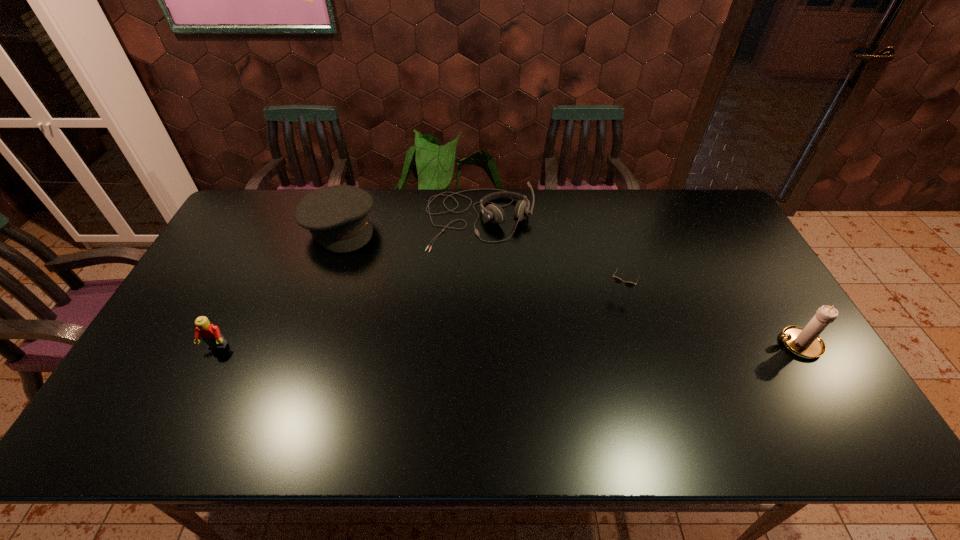
This screenshot has height=540, width=960. I want to click on unoccupied position between the rightmost object and the leftmost object, so click(508, 346).

Where is `vacant space in between the leftmost object and the fourth object from left to right`? This screenshot has height=540, width=960. vacant space in between the leftmost object and the fourth object from left to right is located at coordinates point(418,319).

Where is `vacant space that's between the headset and the leftmost object`? vacant space that's between the headset and the leftmost object is located at coordinates (348, 283).

I want to click on free space that is in between the tallest object and the fourth object from right to left, so click(569, 286).

Where is `vacant point located between the beret and the candle holder`? vacant point located between the beret and the candle holder is located at coordinates (569, 286).

Identify the location of vacant region between the Lego and the headset. The height and width of the screenshot is (540, 960). (348, 283).

Find the location of a particular element. vacant point located between the third nearest object and the tallest object is located at coordinates (708, 318).

Find the location of a particular element. The width and height of the screenshot is (960, 540). blank region between the second object from left to right and the Lego is located at coordinates [x=278, y=287].

You are a GUI agent. You are given a task and a screenshot of the screen. Output one action in this format:
    pyautogui.click(x=<x>, y=<y>)
    Task: Click on the free space between the third object from right to left and the leftmost object
    This screenshot has width=960, height=540.
    Given the screenshot: What is the action you would take?
    (x=348, y=283)

The width and height of the screenshot is (960, 540). Identify the location of the fourth closest object to the rightmost object. (210, 334).